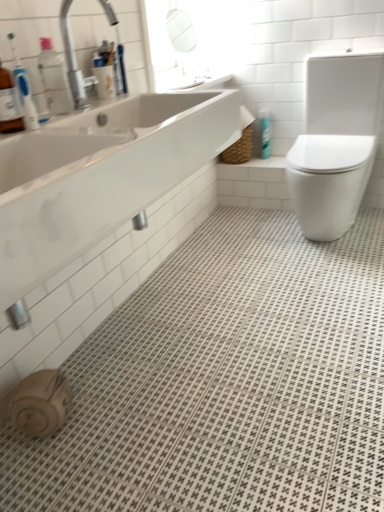
This screenshot has width=384, height=512. I want to click on blue glossy spray can at upper right, so coord(265,133).

At what (x,y) coordinates should I click in order to perform the action: click on white glossy sink at upper left. Please return your answer as a coordinate pair (x, y). This screenshot has width=384, height=512. Looking at the image, I should click on (99, 176).

Locate an element on the screen. white glossy toilet at right is located at coordinates (336, 141).

Would you say white glossy toilet at right is a long distance from white glossy sink at upper left?

No, white glossy toilet at right is not far away from white glossy sink at upper left.

Between white glossy toilet at right and white glossy sink at upper left, which one has smaller width?

white glossy sink at upper left is thinner.

Is white glossy toilet at right taller or shorter than white glossy sink at upper left?

Clearly, white glossy toilet at right is taller compared to white glossy sink at upper left.

Consider the image. Does white glossy toilet at right appear on the left side of white glossy sink at upper left?

Incorrect, white glossy toilet at right is not on the left side of white glossy sink at upper left.

Is white glossy sink at upper left facing away from white glossy toilet at right?

white glossy sink at upper left does not have its back to white glossy toilet at right.

Does white glossy sink at upper left have a lesser width compared to white glossy toilet at right?

Yes.

From the image's perspective, is white glossy sink at upper left beneath white glossy toilet at right?

Correct, white glossy sink at upper left appears lower than white glossy toilet at right in the image.

From a real-world perspective, relative to white glossy toilet at right, is white glossy sink at upper left vertically above or below?

From a real-world perspective, white glossy sink at upper left is physically above white glossy toilet at right.

Is blue glossy spray can at upper right facing away from white glossy sink at upper left?

No.

Does blue glossy spray can at upper right appear on the right side of white glossy sink at upper left?

Correct, you'll find blue glossy spray can at upper right to the right of white glossy sink at upper left.

How different are the orientations of blue glossy spray can at upper right and white glossy sink at upper left in degrees?

The angular difference between blue glossy spray can at upper right and white glossy sink at upper left is 87.7 degrees.

Considering the positions of point (264, 129) and point (82, 173), is point (264, 129) closer or farther from the camera than point (82, 173)?

Point (264, 129).

Locate an element on the screen. The width and height of the screenshot is (384, 512). toiletry behind the silver metallic faucet at upper left is located at coordinates [x=265, y=133].

Is silver metallic faucet at upper left bigger than blue glossy spray can at upper right?

Indeed, silver metallic faucet at upper left has a larger size compared to blue glossy spray can at upper right.

Is silver metallic faucet at upper left in front of blue glossy spray can at upper right?

Yes, silver metallic faucet at upper left is closer to the viewer.

Looking at this image, from a real-world perspective, between silver metallic faucet at upper left and blue glossy spray can at upper right, who is vertically lower?

blue glossy spray can at upper right, from a real-world perspective.

Considering the relative sizes of white glossy toilet at right and blue glossy spray can at upper right in the image provided, is white glossy toilet at right taller than blue glossy spray can at upper right?

Correct, white glossy toilet at right is much taller as blue glossy spray can at upper right.

From the image's perspective, is white glossy toilet at right located above blue glossy spray can at upper right?

Actually, white glossy toilet at right appears below blue glossy spray can at upper right in the image.

Which is nearer, (373, 88) or (267, 129)?

Positioned in front is point (373, 88).

Is white glossy toilet at right wider than blue glossy spray can at upper right?

Yes, white glossy toilet at right is wider than blue glossy spray can at upper right.

From the image's perspective, between white glossy sink at upper left and silver metallic faucet at upper left, who is located below?

white glossy sink at upper left, from the image's perspective.

Is white glossy sink at upper left facing away from silver metallic faucet at upper left?

That's not correct — white glossy sink at upper left is not looking away from silver metallic faucet at upper left.

Can you confirm if white glossy sink at upper left is bigger than silver metallic faucet at upper left?

Yes, white glossy sink at upper left is bigger than silver metallic faucet at upper left.

Can you confirm if white glossy sink at upper left is wider than silver metallic faucet at upper left?

Indeed, white glossy sink at upper left has a greater width compared to silver metallic faucet at upper left.

Considering the sizes of objects white glossy sink at upper left and blue glossy spray can at upper right in the image provided, who is bigger, white glossy sink at upper left or blue glossy spray can at upper right?

Bigger between the two is white glossy sink at upper left.

Is white glossy sink at upper left far away from blue glossy spray can at upper right?

Yes, white glossy sink at upper left and blue glossy spray can at upper right are located far from each other.

Find the location of `toiletry above the white glossy sink at upper left (from the image's perspective)`. toiletry above the white glossy sink at upper left (from the image's perspective) is located at coordinates (265, 133).

From the image's perspective, is white glossy sink at upper left positioned above or below blue glossy spray can at upper right?

white glossy sink at upper left is situated lower than blue glossy spray can at upper right in the image.

Identify the location of toilet above the white glossy sink at upper left (from the image's perspective). (336, 141).

At what (x,y) coordinates should I click in order to perform the action: click on sink below the white glossy toilet at right (from the image's perspective). Please return your answer as a coordinate pair (x, y). This screenshot has width=384, height=512. Looking at the image, I should click on (99, 176).

From the image, which object appears to be nearer to blue glossy spray can at upper right, silver metallic faucet at upper left or white glossy toilet at right?

The object closer to blue glossy spray can at upper right is white glossy toilet at right.

Looking at the image, which one is located closer to blue glossy spray can at upper right, silver metallic faucet at upper left or white glossy sink at upper left?

silver metallic faucet at upper left is positioned closer to the anchor blue glossy spray can at upper right.

Looking at the image, which one is located further to white glossy toilet at right, white glossy sink at upper left or silver metallic faucet at upper left?

silver metallic faucet at upper left.

When comparing their distances from white glossy sink at upper left, does white glossy toilet at right or silver metallic faucet at upper left seem closer?

Based on the image, silver metallic faucet at upper left appears to be nearer to white glossy sink at upper left.

Looking at this image, considering their positions, is white glossy sink at upper left positioned closer to silver metallic faucet at upper left than white glossy toilet at right?

white glossy sink at upper left is positioned closer to the anchor silver metallic faucet at upper left.

Considering their positions, is blue glossy spray can at upper right positioned further to silver metallic faucet at upper left than white glossy toilet at right?

Among the two, blue glossy spray can at upper right is located further to silver metallic faucet at upper left.

Looking at the image, which one is located closer to blue glossy spray can at upper right, white glossy sink at upper left or white glossy toilet at right?

white glossy toilet at right.

When comparing their distances from white glossy toilet at right, does silver metallic faucet at upper left or white glossy sink at upper left seem further?

silver metallic faucet at upper left is further to white glossy toilet at right.

This screenshot has height=512, width=384. Identify the location of tap positioned between white glossy sink at upper left and blue glossy spray can at upper right from near to far. (71, 59).

Identify the location of sink located between silver metallic faucet at upper left and white glossy toilet at right in the left-right direction. (99, 176).

Locate an element on the screen. The image size is (384, 512). toilet located between white glossy sink at upper left and blue glossy spray can at upper right in the depth direction is located at coordinates (336, 141).

Identify the location of toilet between silver metallic faucet at upper left and blue glossy spray can at upper right from front to back. The width and height of the screenshot is (384, 512). (336, 141).